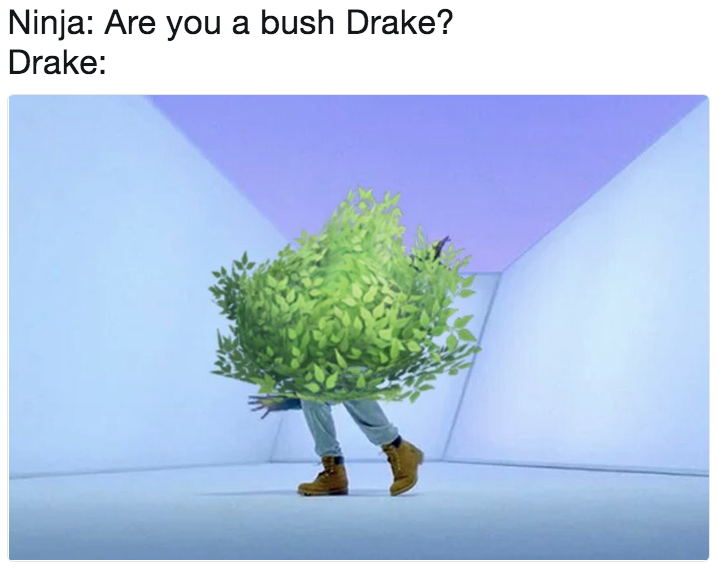
Where is `blue floor`? blue floor is located at coordinates (453, 505).